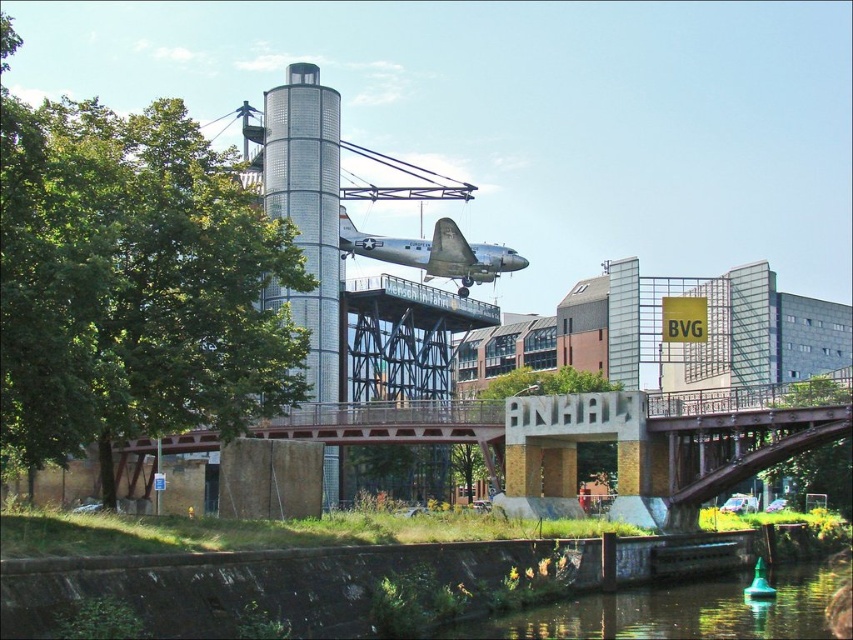
Question: Does brown metal bridge at center have a smaller size compared to silver metallic airplane at center?

Choices:
 (A) no
 (B) yes

Answer: (A)

Question: Which point is farther from the camera taking this photo?

Choices:
 (A) (503, 257)
 (B) (641, 435)

Answer: (A)

Question: Does brown metal bridge at center appear under silver metallic airplane at center?

Choices:
 (A) no
 (B) yes

Answer: (B)

Question: Which of these objects is positioned farthest from the green water at lower center?

Choices:
 (A) brown metal bridge at center
 (B) silver metallic airplane at center

Answer: (B)

Question: In this image, where is brown metal bridge at center located relative to silver metallic airplane at center?

Choices:
 (A) left
 (B) right

Answer: (A)

Question: Among these objects, which one is nearest to the camera?

Choices:
 (A) brown metal bridge at center
 (B) green water at lower center
 (C) silver metallic airplane at center

Answer: (B)